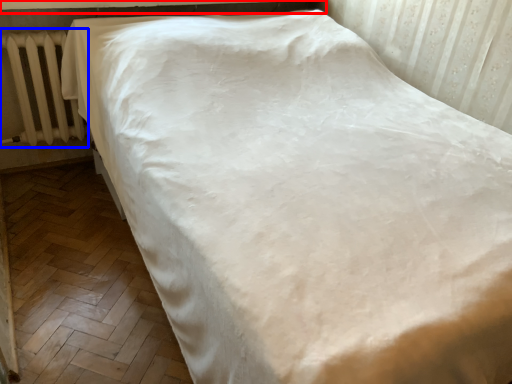
Question: Which point is closer to the camera, window sill (highlighted by a red box) or radiator (highlighted by a blue box)?

Choices:
 (A) window sill
 (B) radiator

Answer: (A)